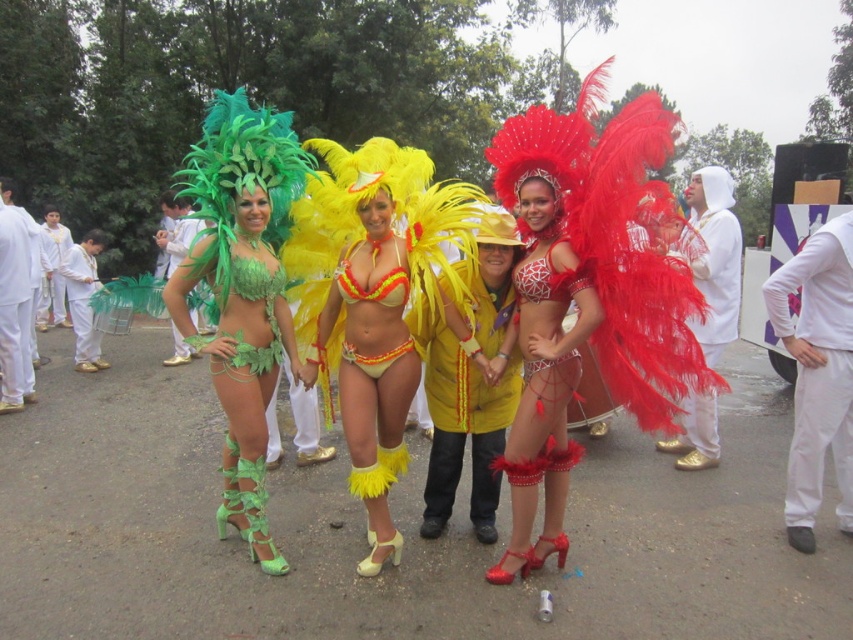
Who is higher up, green matte bikini at left or matte green fabric bikini at center?

matte green fabric bikini at center is higher up.

Locate an element on the screen. green matte bikini at left is located at coordinates (241, 291).

What do you see at coordinates (241, 291) in the screenshot? I see `green matte bikini at left` at bounding box center [241, 291].

This screenshot has width=853, height=640. Find the location of `green matte bikini at left`. green matte bikini at left is located at coordinates (241, 291).

Is the position of white matte pants at right less distant than that of matte green fabric bikini at center?

Yes, it is in front of matte green fabric bikini at center.

Does white matte pants at right come behind matte green fabric bikini at center?

No, it is not.

Between point (809, 372) and point (80, 371), which one is positioned in front?

Point (809, 372) is more forward.

Locate an element on the screen. This screenshot has width=853, height=640. white matte pants at right is located at coordinates (817, 372).

Which is in front, point (329, 339) or point (74, 321)?

Positioned in front is point (329, 339).

Is yellow feathered bikini at center above matte green fabric bikini at center?

No.

Who is more forward, (358,378) or (67,256)?

Point (358,378)

The image size is (853, 640). In order to click on yellow feathered bikini at center in this screenshot , I will do `click(373, 339)`.